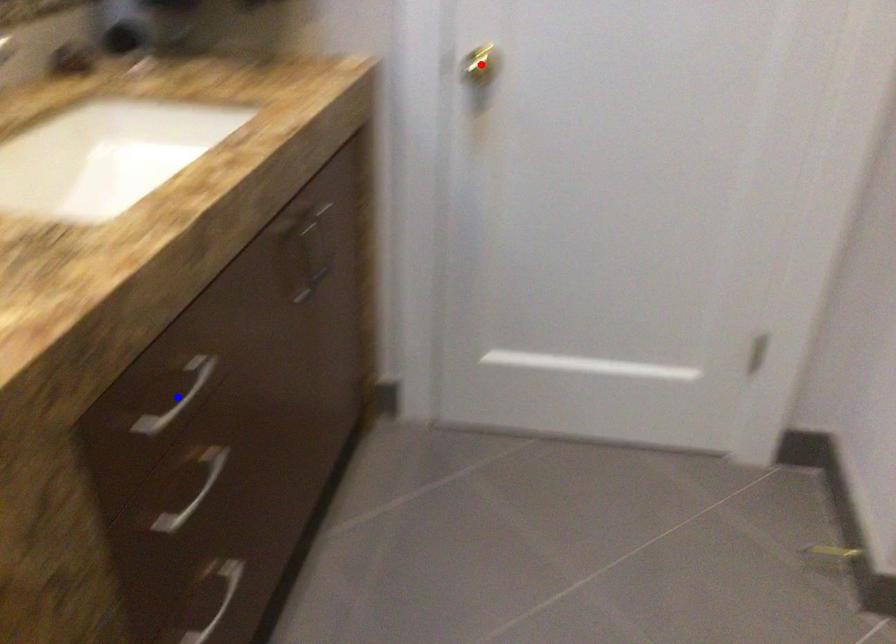
Question: In the image, two points are highlighted. Which point is nearer to the camera? Reply with the corresponding letter.

Choices:
 (A) blue point
 (B) red point

Answer: (A)